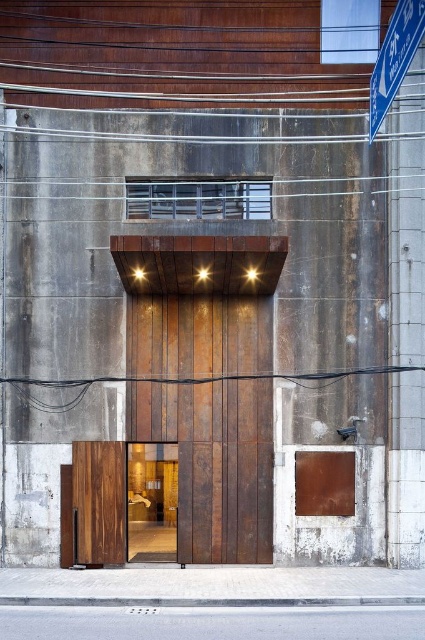
structural analysis required. Determine the spatial relationship between the rusty wood elevator at center and the rustic wood door at center in the scene. Specifically, which object is positioned to the left?

structural analysis shows the rusty wood elevator at center is to the right of rustic wood door at center, so the rustic wood door at center is positioned to the left.

You are an architect designing a new building and want to place two lights at the coordinates point (272,486) and point (156,516). Based on the image, which light will be more visible to someone standing in front of the building?

Point (272,486) will be more visible because it is in front of point (156,516), so it won not be blocked by any structure.

Looking at this image, you are standing in front of the modern architectural facade and want to determine which of the two points, point (215, 442) or point (391, 96), is closer to you. Based on the scene description, which point is nearer?

Point (215, 442) is further to the viewer than point (391, 96). Therefore, point (391, 96) is closer to you.